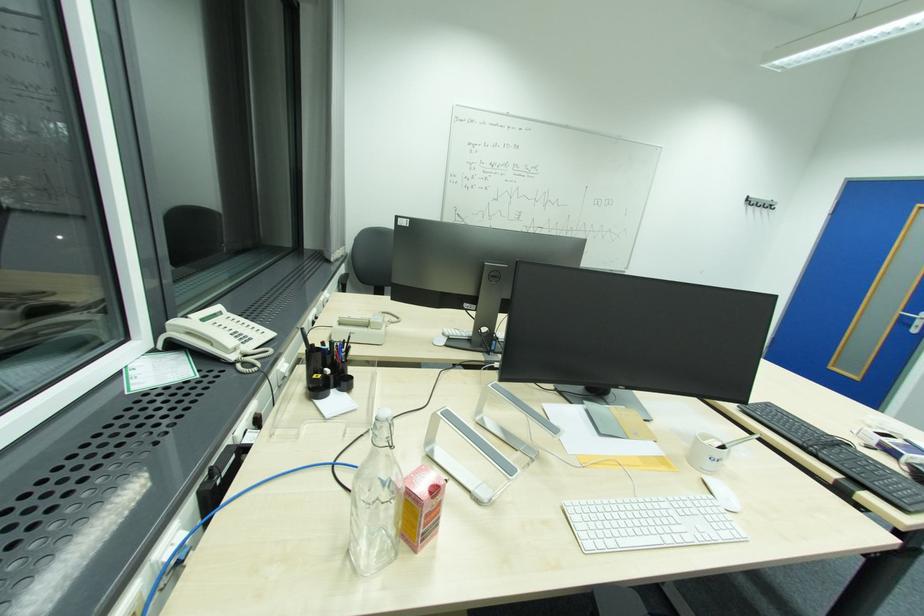
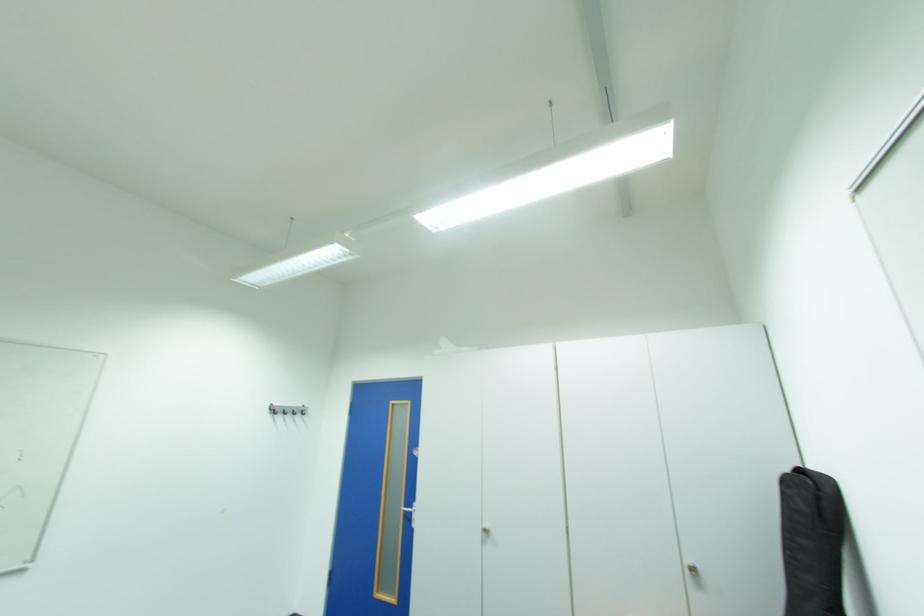
In the second image, find the point that corresponds to point (755, 204) in the first image.

(280, 411)